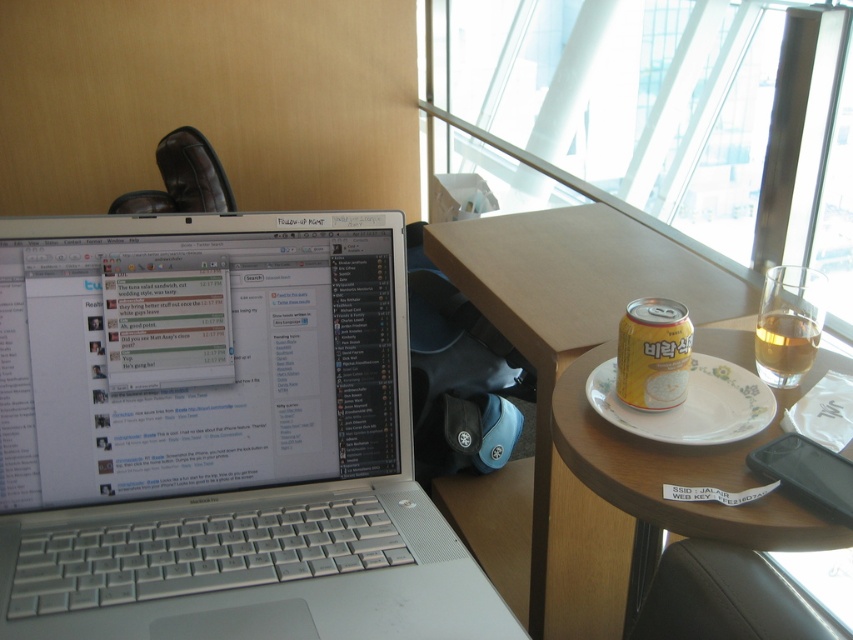
You are a traveler sitting at the wooden table at center in an airport lounge. You want to check the weather outside through the transparent glass window at upper center. Can you see the window clearly from your seat?

The transparent glass window at upper center is larger than the wooden table at center, so yes, you can see the window clearly from your seat at the wooden table at center.

What are the coordinates of the silver metallic laptop at center?

The silver metallic laptop at center is located at coordinates point (x=218, y=435).